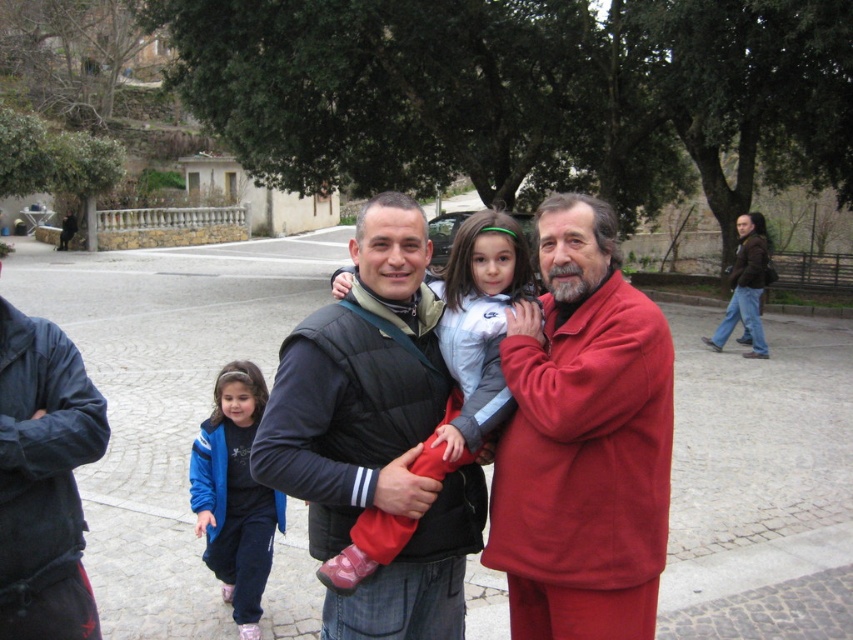
You are standing at the origin point of the image. You want to move towards the point labeled as point (33,480). However, there is an obstacle at point (380,440). Will you encounter the obstacle before reaching your destination?

Since point (380,440) is behind point (33,480), you will not encounter the obstacle before reaching your destination.

You are a photographer trying to capture a photo of the black quilted vest at center without the matte red jacket at center blocking it. What should you do?

Move the camera position backward so that the black quilted vest at center is no longer behind the matte red jacket at center.